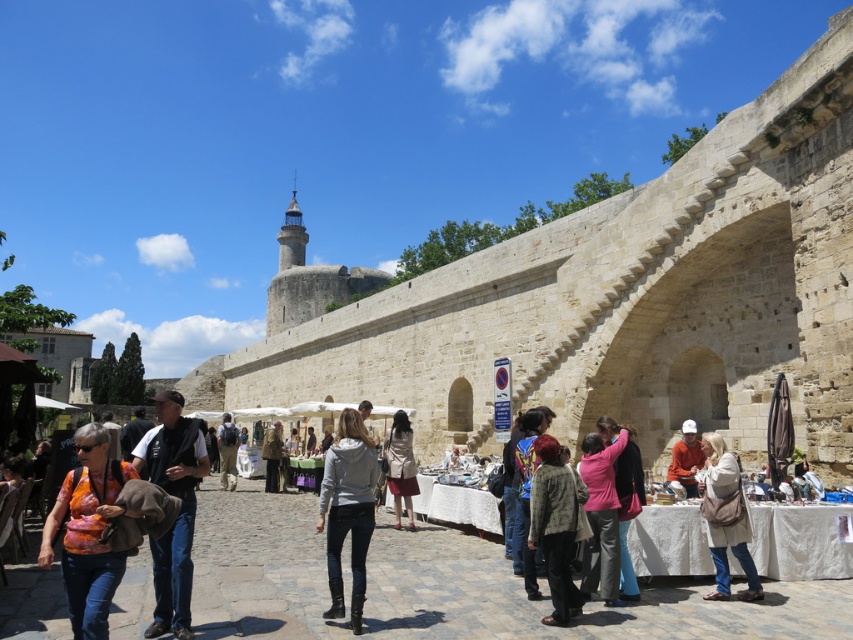
Is point (73, 614) positioned in front of point (270, 449)?

Yes, point (73, 614) is in front of point (270, 449).

Between printed cotton shirt at lower left and leather jacket at center, which one is positioned lower?

leather jacket at center

At what (x,y) coordinates should I click in order to perform the action: click on printed cotton shirt at lower left. Please return your answer as a coordinate pair (x, y). This screenshot has height=640, width=853. Looking at the image, I should click on (86, 531).

Measure the distance from pink fabric jacket at center to light brown leather jacket at lower right.

4.35 meters

Identify the location of pink fabric jacket at center. (601, 515).

Is point (601, 464) in front of point (727, 564)?

That is False.

Find the location of `pink fabric jacket at center`. pink fabric jacket at center is located at coordinates (601, 515).

Is light brown fur coat at lower right thinner than leather jacket at center?

Correct, light brown fur coat at lower right's width is less than leather jacket at center's.

Who is more forward, (x=556, y=536) or (x=277, y=433)?

Point (x=556, y=536)

Identify the location of light brown fur coat at lower right. The width and height of the screenshot is (853, 640). (555, 525).